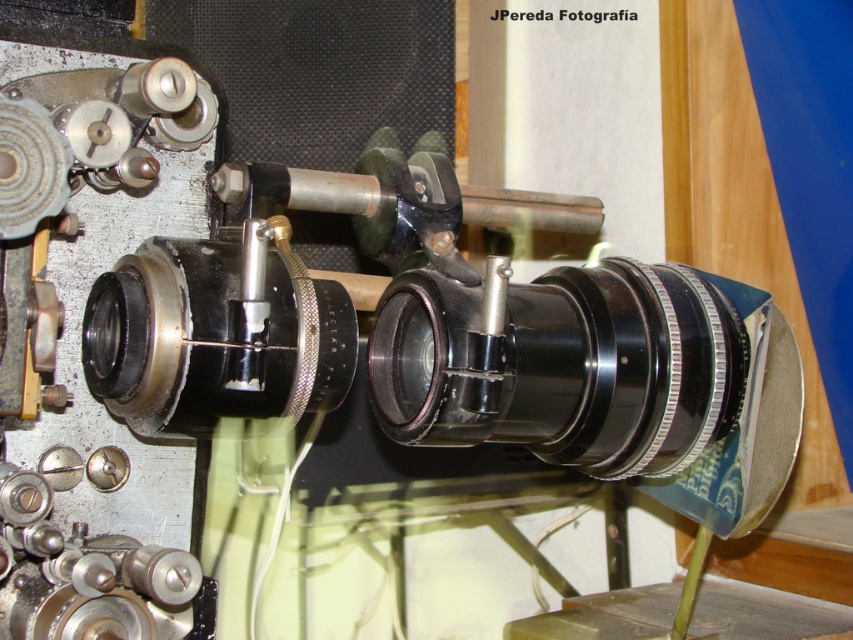
Question: Which point is closer to the camera taking this photo?

Choices:
 (A) (457, 444)
 (B) (202, 330)

Answer: (B)

Question: Is black metallic lens at center closer to camera compared to matte black lens at center?

Choices:
 (A) yes
 (B) no

Answer: (B)

Question: Which object appears closest to the camera in this image?

Choices:
 (A) matte black lens at center
 (B) black metallic lens at center

Answer: (A)

Question: Can you confirm if black metallic lens at center is bigger than matte black lens at center?

Choices:
 (A) no
 (B) yes

Answer: (B)

Question: In this image, where is black metallic lens at center located relative to matte black lens at center?

Choices:
 (A) left
 (B) right

Answer: (B)